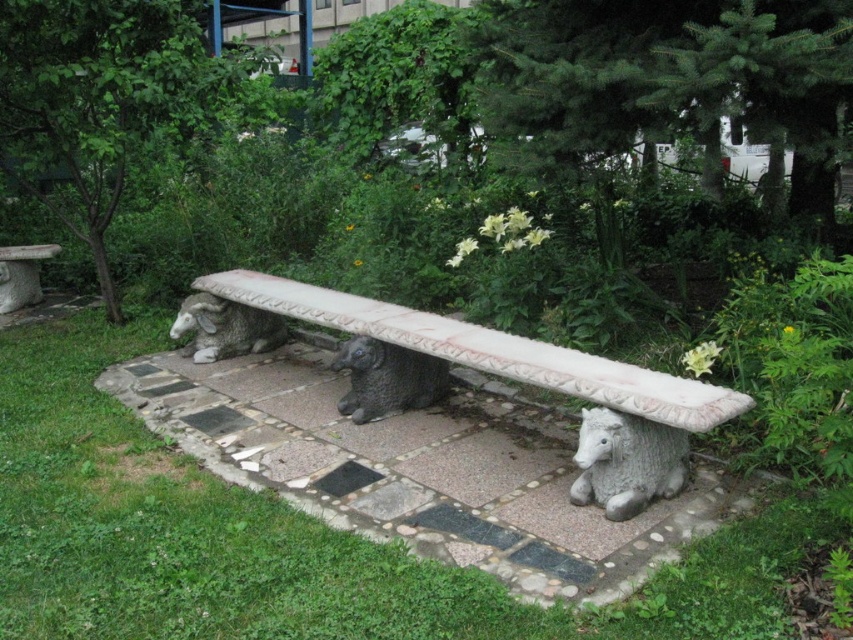
You are a gardener planning to place a tall potted plant next to the white stone bench at center and the gray stone bench at center. Which bench should you choose to ensure the plant is visible from above the bench?

The white stone bench at center has a greater height compared to the gray stone bench at center, so placing the tall potted plant next to the gray stone bench at center would make it more visible from above since it is shorter.

Looking at this image, you are standing in front of the garden bench and want to place a small potted plant between the two points, point [413,492] and point [563,387]. Which point should you place it closer to so that the plant appears closer to you?

You should place the potted plant closer to point [413,492] because it is closer to you than point [563,387].

Consider the image. You are a gardener planning to place a new flowerpot between the gray stone bench at center and the gray stone sheep at left. Based on their positions, which object should the flowerpot be closer to?

The gray stone bench at center is located above the gray stone sheep at left, so the flowerpot should be placed closer to the gray stone sheep at left to maintain balance between them.